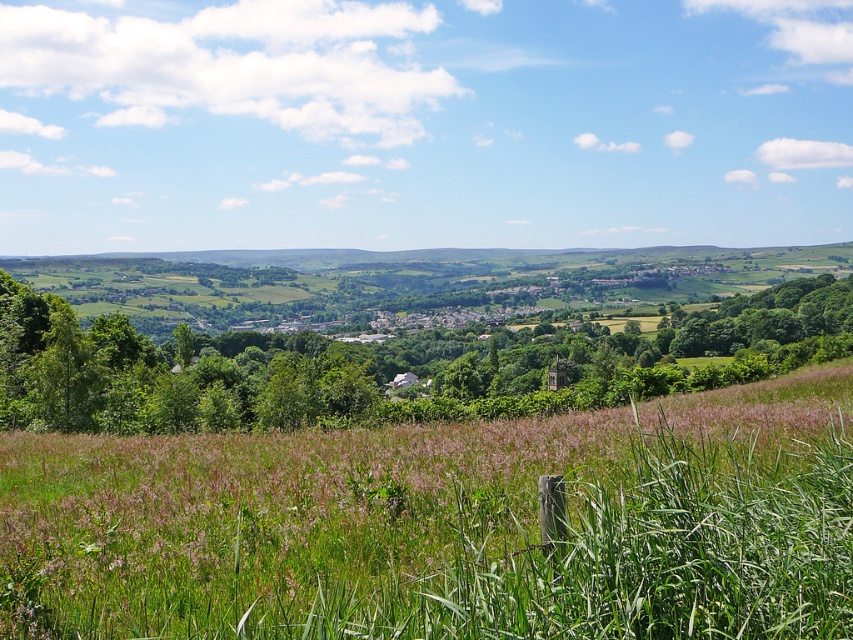
You are a hiker standing in the middle of the field. You notice the green grass at center and the green leafy tree at center. Which one is taller?

The green leafy tree at center is taller than the green grass at center.

You are standing in the rural landscape and want to take a photo of the green grass at center and the green leafy tree at center. Which object should you focus on first if you want both to be in clear focus?

The green grass at center is below the green leafy tree at center. Since the grass is closer to the camera, you should focus on the green grass at center first to ensure both are in focus.